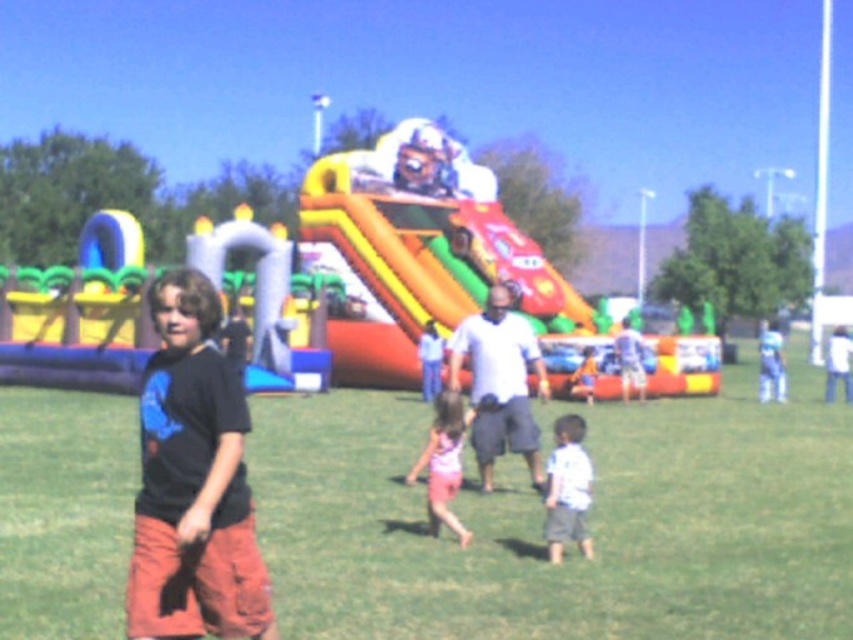
You are standing at the point labeled point (570, 481) and want to walk towards the point labeled point (431, 522). Since both points are in the image, which direction should you move to get closer to your destination?

You should move away from the camera because point (431, 522) is further from the camera than point (570, 481).